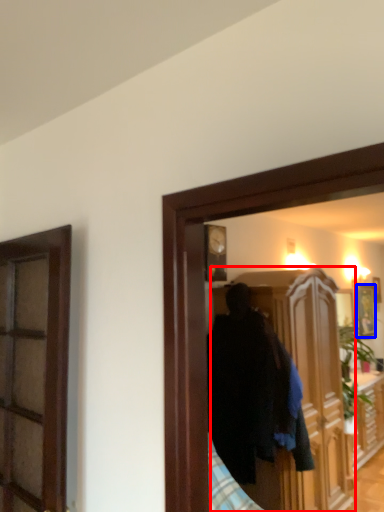
Question: Which object is closer to the camera taking this photo, cabinetry (highlighted by a red box) or picture frame (highlighted by a blue box)?

Choices:
 (A) cabinetry
 (B) picture frame

Answer: (A)